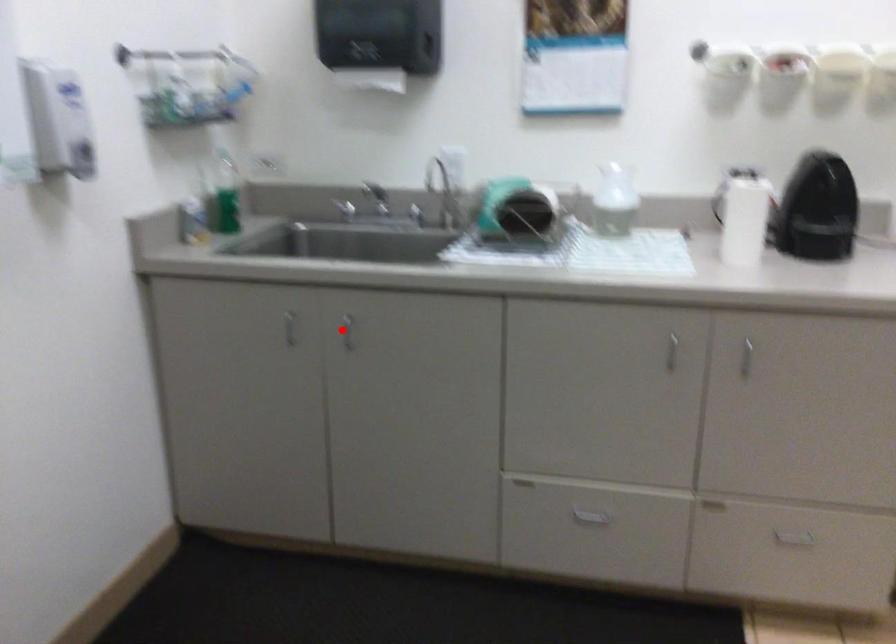
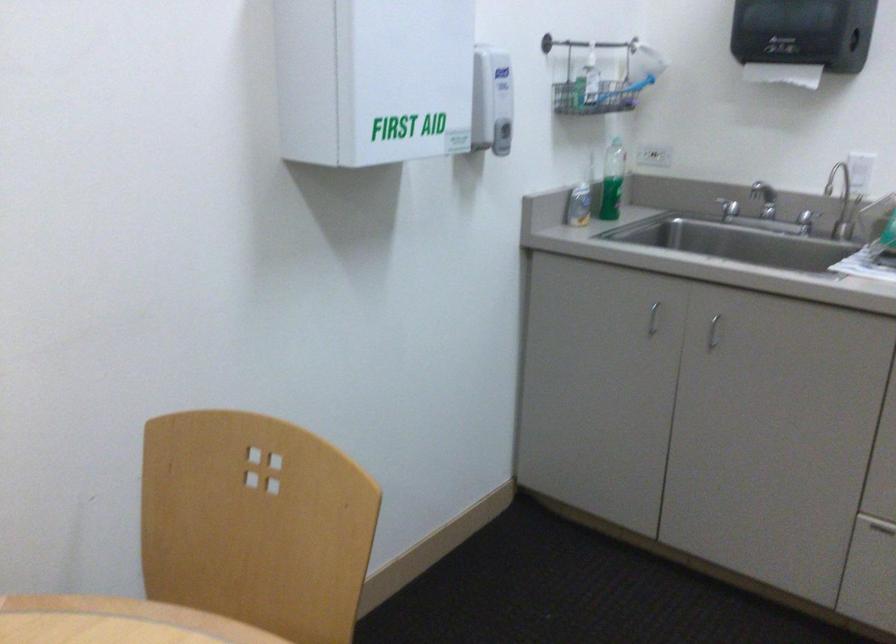
Locate, in the second image, the point that corresponds to the highlighted location in the first image.

(712, 332)